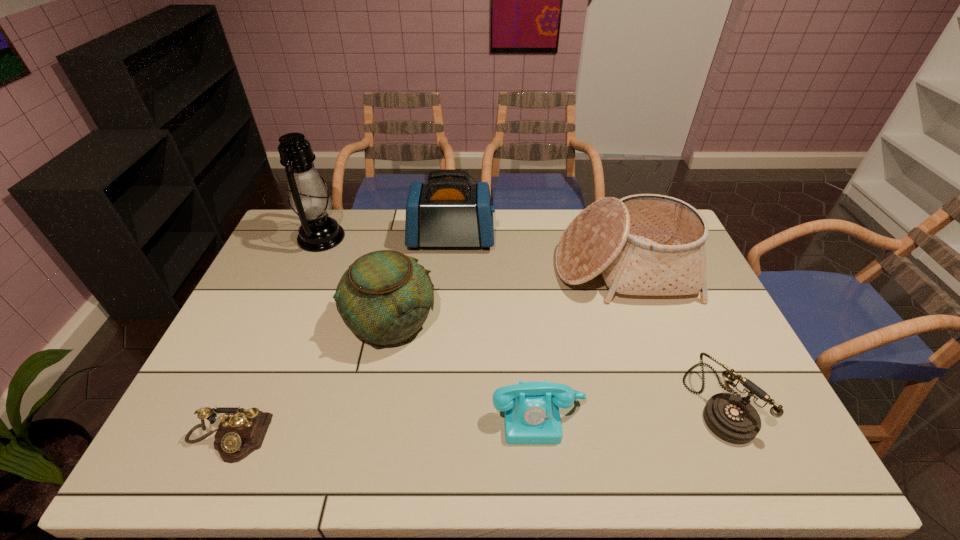
Locate an element on the screen. object situated at the near left corner is located at coordinates (242, 431).

Image resolution: width=960 pixels, height=540 pixels. I want to click on object present at the far right corner, so click(x=646, y=244).

Locate an element on the screen. Image resolution: width=960 pixels, height=540 pixels. object at the near right corner is located at coordinates (732, 418).

At what (x,y) coordinates should I click in order to perform the action: click on free space at the far edge of the desktop. Please return your answer as a coordinate pair (x, y). This screenshot has height=540, width=960. Looking at the image, I should click on (536, 210).

Identify the location of vacant region at the near edge of the desktop. This screenshot has width=960, height=540. (687, 469).

Image resolution: width=960 pixels, height=540 pixels. In order to click on vacant region at the left edge of the desktop in this screenshot , I will do `click(274, 284)`.

Identify the location of free space at the right edge of the desktop. The width and height of the screenshot is (960, 540). (714, 351).

This screenshot has height=540, width=960. In the image, there is a desktop. Identify the location of vacant space at the near left corner. (175, 448).

At what (x,y) coordinates should I click in order to perform the action: click on vacant area between the fourth shortest object and the rightmost telephone. Please return your answer as a coordinate pair (x, y). This screenshot has width=960, height=540. Looking at the image, I should click on (555, 362).

Locate an element on the screen. free space between the basket and the second telephone from left to right is located at coordinates (581, 342).